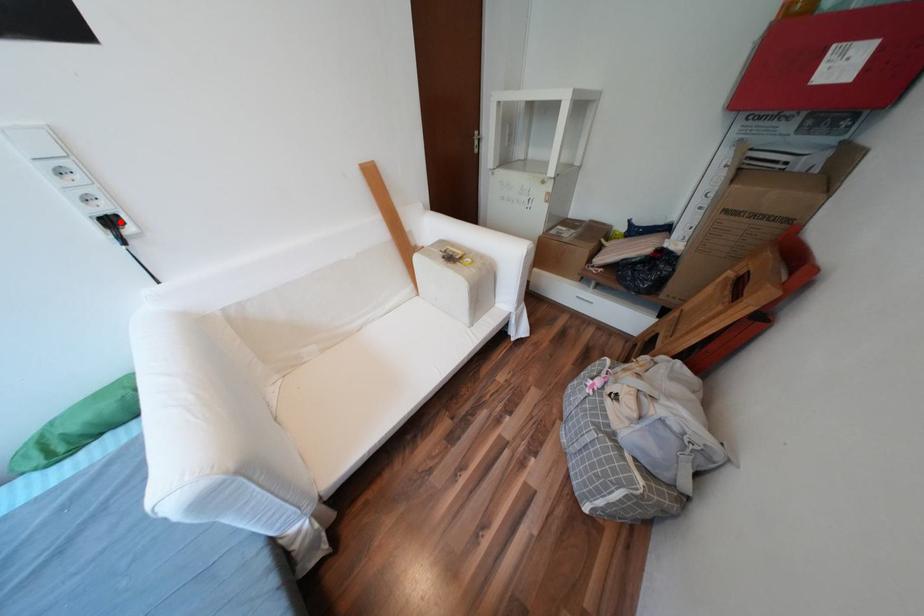
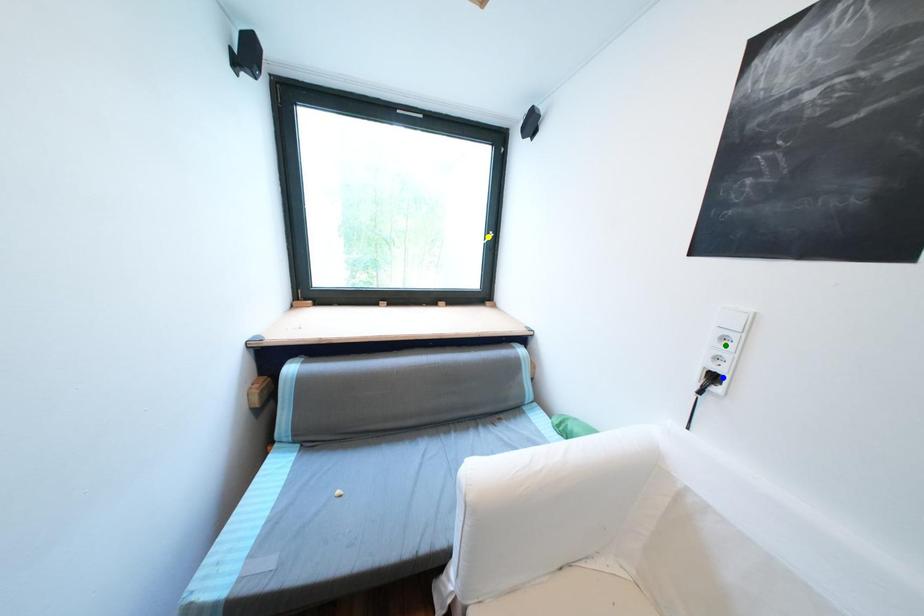
Question: I am providing you with two images of the same scene from different viewpoints. A red point is marked on the first image. You are given multiple points on the second image. Which spot in image 2 lines up with the point in image 1?

Choices:
 (A) blue point
 (B) green point
 (C) yellow point

Answer: (A)